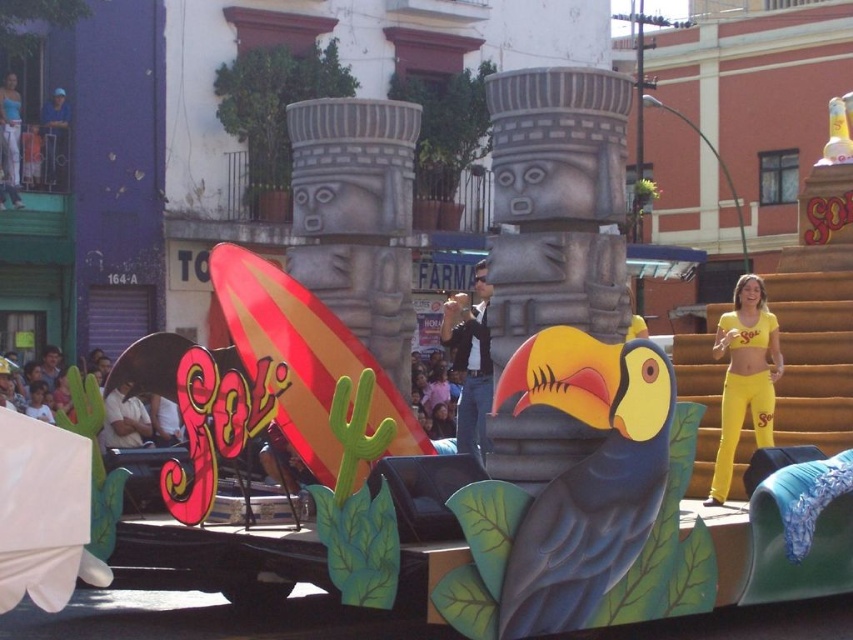
Can you confirm if yellow matte/yellow fabric at right is taller than denim jeans at center?

In fact, yellow matte/yellow fabric at right may be shorter than denim jeans at center.

What do you see at coordinates (744, 376) in the screenshot?
I see `yellow matte/yellow fabric at right` at bounding box center [744, 376].

Find the location of a particular element. The image size is (853, 640). yellow matte/yellow fabric at right is located at coordinates (744, 376).

Does matte blue toucan at center have a lesser height compared to denim jeans at center?

Yes.

Can you confirm if matte blue toucan at center is positioned to the right of denim jeans at center?

Correct, you'll find matte blue toucan at center to the right of denim jeans at center.

Does point (643, 417) come closer to viewer compared to point (456, 324)?

Yes, point (643, 417) is closer to viewer.

What are the coordinates of `matte blue toucan at center` in the screenshot? It's located at (585, 476).

Is point (610, 524) behind point (727, 433)?

No.

Is matte blue toucan at center smaller than yellow matte/yellow fabric at right?

Yes.

Describe the element at coordinates (585, 476) in the screenshot. I see `matte blue toucan at center` at that location.

Find the location of a particular element. This screenshot has height=640, width=853. matte blue toucan at center is located at coordinates (585, 476).